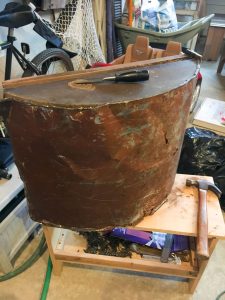
At what (x,y) coordinates should I click in order to perform the action: click on floor. Please return your answer as a coordinate pair (x, y). Image resolution: width=225 pixels, height=300 pixels. Looking at the image, I should click on (93, 290).